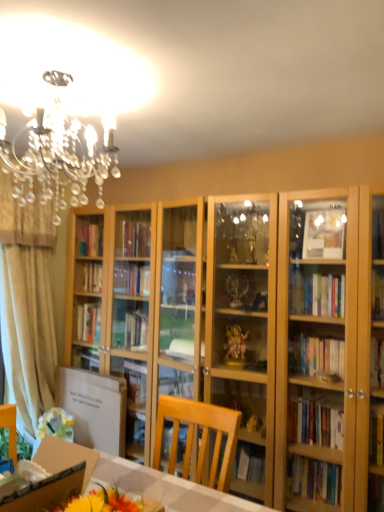
Question: From a real-world perspective, is white cardboard box at lower left beneath wooden desk at lower left?

Choices:
 (A) no
 (B) yes

Answer: (A)

Question: From the image's perspective, is white cardboard box at lower left on top of wooden desk at lower left?

Choices:
 (A) no
 (B) yes

Answer: (B)

Question: Are white cardboard box at lower left and wooden desk at lower left beside each other?

Choices:
 (A) no
 (B) yes

Answer: (A)

Question: Would you consider white cardboard box at lower left to be distant from wooden desk at lower left?

Choices:
 (A) yes
 (B) no

Answer: (B)

Question: Can you confirm if white cardboard box at lower left is taller than wooden desk at lower left?

Choices:
 (A) no
 (B) yes

Answer: (B)

Question: Is white cardboard box at lower left further to the viewer compared to wooden desk at lower left?

Choices:
 (A) no
 (B) yes

Answer: (B)

Question: Is wooden desk at lower left to the right of beige fabric curtain at left from the viewer's perspective?

Choices:
 (A) yes
 (B) no

Answer: (A)

Question: Is wooden desk at lower left aimed at beige fabric curtain at left?

Choices:
 (A) no
 (B) yes

Answer: (A)

Question: Is beige fabric curtain at left surrounded by wooden desk at lower left?

Choices:
 (A) yes
 (B) no

Answer: (B)

Question: Is wooden desk at lower left oriented away from beige fabric curtain at left?

Choices:
 (A) yes
 (B) no

Answer: (B)

Question: Is wooden desk at lower left not near beige fabric curtain at left?

Choices:
 (A) yes
 (B) no

Answer: (A)

Question: From a real-world perspective, is wooden desk at lower left below beige fabric curtain at left?

Choices:
 (A) no
 (B) yes

Answer: (B)

Question: Does white cardboard box at lower left have a smaller size compared to beige fabric curtain at left?

Choices:
 (A) no
 (B) yes

Answer: (B)